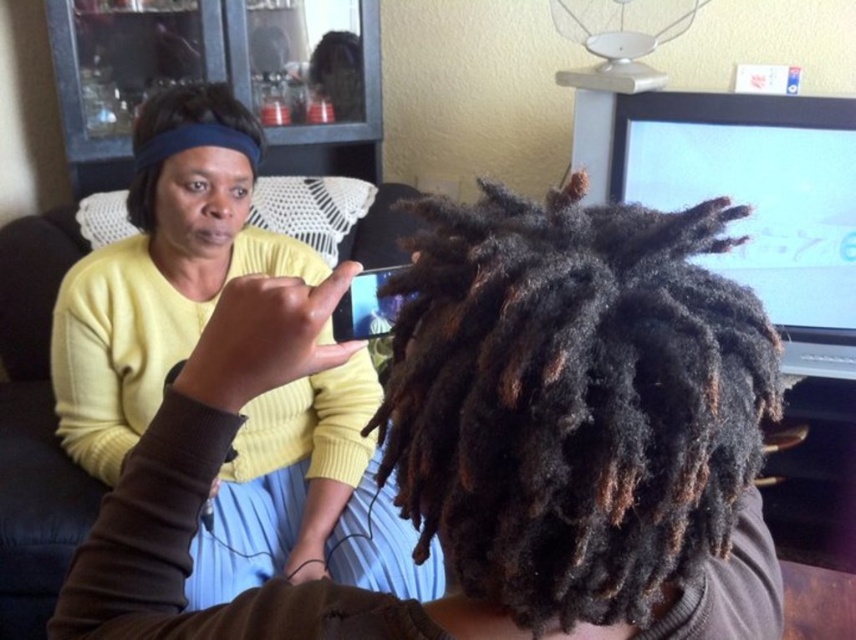
You are designing a layout for a magazine cover and need to place two elements based on their sizes. The matte yellow sweater at upper left and the black matte hair at upper left are the elements. Which element should you choose to place in a larger space to maintain visual balance?

The matte yellow sweater at upper left should be placed in a larger space because it has a larger size compared to the black matte hair at upper left, ensuring visual balance.

Based on the photo, you are a photographer trying to capture a closeup of the dark curly hair at center and the black matte hair at upper left. Which one is positioned lower in the frame?

The dark curly hair at center is positioned lower in the frame than the black matte hair at upper left.

You are standing in the room shown in the image. If you want to locate the dark curly hair at center, where would you look relative to the center of the image?

The dark curly hair at center is located at the center of the image since its 2D coordinates are exactly at point [580,412], which corresponds to the central area.